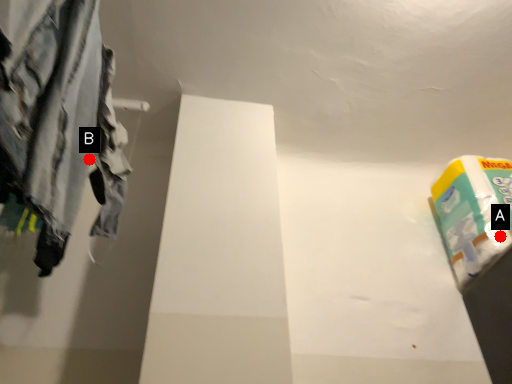
Question: Two points are circled on the image, labeled by A and B beside each circle. Which point is closer to the camera taking this photo?

Choices:
 (A) A is closer
 (B) B is closer

Answer: (B)